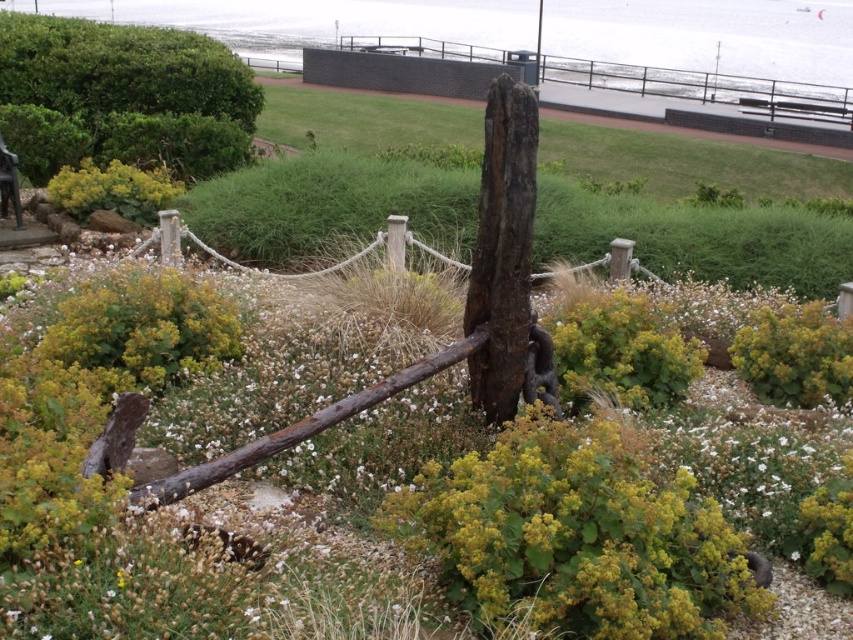
Question: Is rustic wooden fence at upper center bigger than yellow-green leafy plant at upper left?

Choices:
 (A) no
 (B) yes

Answer: (B)

Question: Among these points, which one is farthest from the camera?

Choices:
 (A) (410, 48)
 (B) (158, 168)
 (C) (0, 134)

Answer: (A)

Question: Does rustic wooden fence at upper center have a smaller size compared to yellow-green leafy plant at upper left?

Choices:
 (A) yes
 (B) no

Answer: (B)

Question: Which point appears closest to the camera in this image?

Choices:
 (A) (0, 166)
 (B) (463, 56)
 (C) (4, 67)
 (D) (149, 179)

Answer: (A)

Question: Where is green leafy bush at upper left located in relation to rustic wooden fence at upper center in the image?

Choices:
 (A) above
 (B) below

Answer: (B)

Question: Which object appears closest to the camera in this image?

Choices:
 (A) green leafy bush at upper left
 (B) wooden park bench at lower left

Answer: (B)